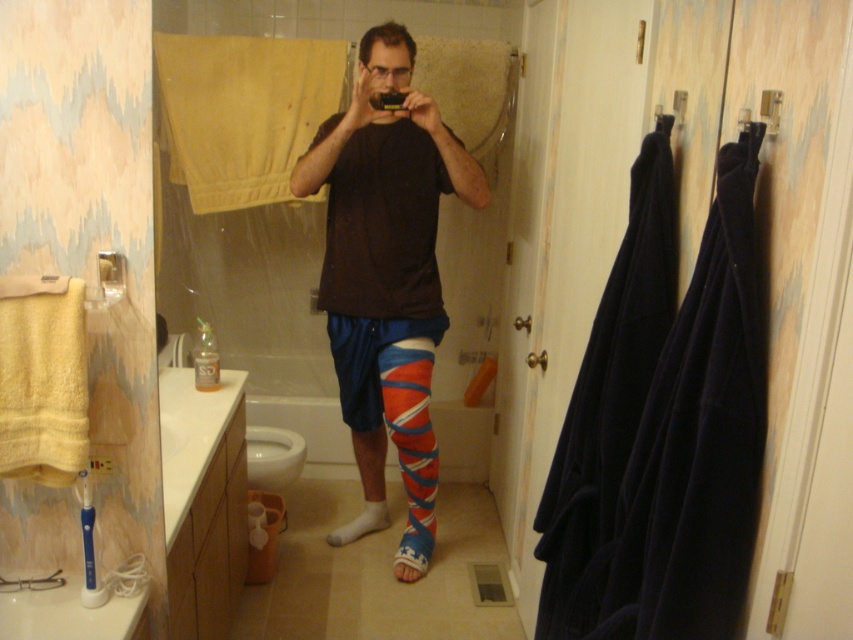
You are a fashion designer analyzing the bathroom scene. You need to determine which item is higher in height between the matte blue shorts at center and the white cotton sock at lower center. Which one is taller?

The matte blue shorts at center is taller than the white cotton sock at lower center according to the scene description.

From the picture: You are a photographer trying to capture the person in the bathroom. The person is standing in front of the mirror holding a camera. You want to position your camera at point (387, 269) to get a clear shot of the blue shorts at center. Is this point on the blue shorts?

Yes, the point (387, 269) is on the matte blue shorts at center, so positioning your camera there would allow you to capture the blue shorts clearly.